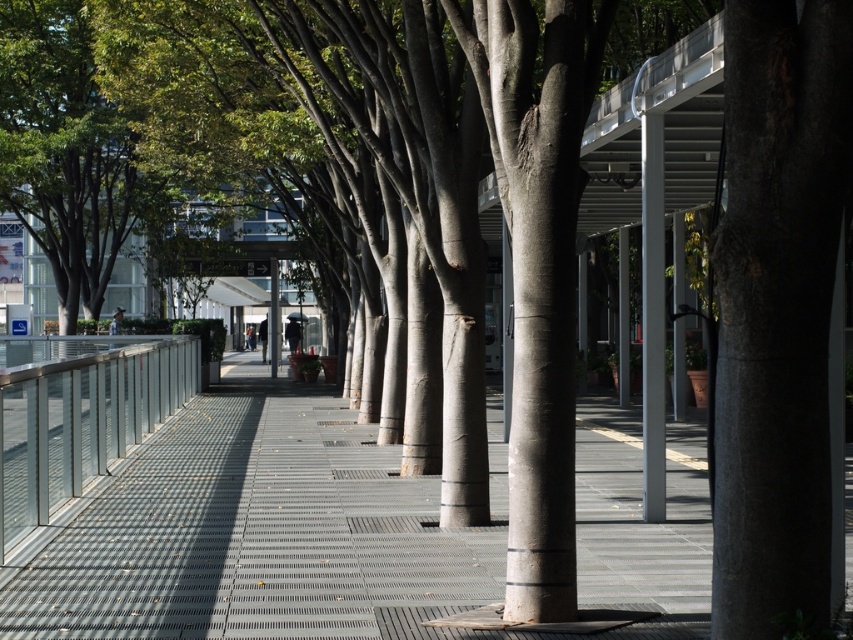
Who is taller, smooth gray tree trunk at center or metallic gray pole at center?

With more height is metallic gray pole at center.

Is point (769, 506) farther from camera compared to point (653, 246)?

No.

Where is `smooth gray tree trunk at center`? This screenshot has width=853, height=640. smooth gray tree trunk at center is located at coordinates (776, 310).

Is point (579, 525) positioned in front of point (737, 33)?

No, it is behind (737, 33).

Consider the image. Does metallic grid pavement at center have a greater height compared to smooth gray tree trunk at center?

In fact, metallic grid pavement at center may be shorter than smooth gray tree trunk at center.

Locate an element on the screen. Image resolution: width=853 pixels, height=640 pixels. metallic grid pavement at center is located at coordinates (257, 532).

Where is `metallic grid pavement at center`? The image size is (853, 640). metallic grid pavement at center is located at coordinates [257, 532].

Between point (257, 486) and point (654, 422), which one is positioned in front?

Point (654, 422) is more forward.

Can you confirm if metallic grid pavement at center is bigger than metallic gray pole at center?

Correct, metallic grid pavement at center is larger in size than metallic gray pole at center.

Find the location of a particular element. This screenshot has width=853, height=640. metallic grid pavement at center is located at coordinates (257, 532).